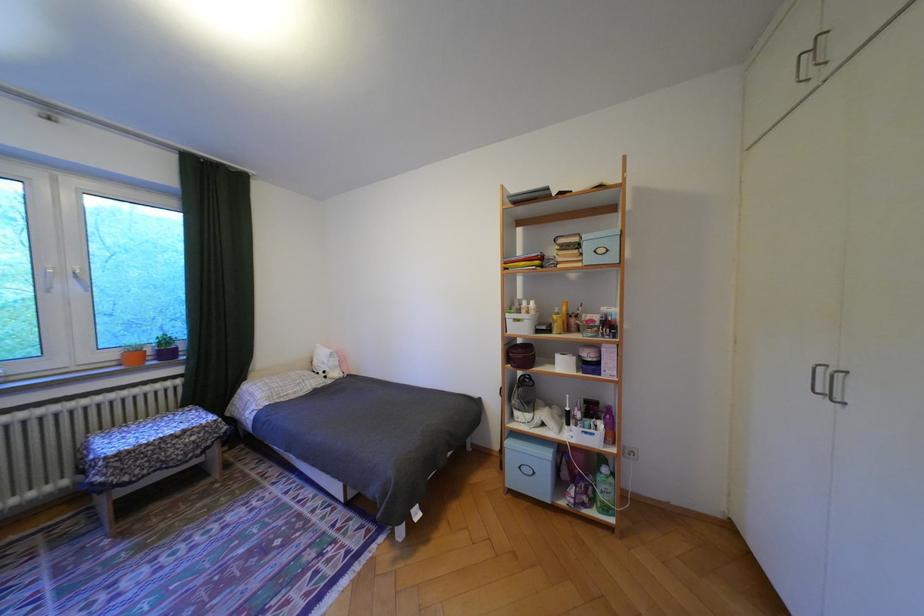
Find the location of `yellow spray bottle`. yellow spray bottle is located at coordinates (556, 321).